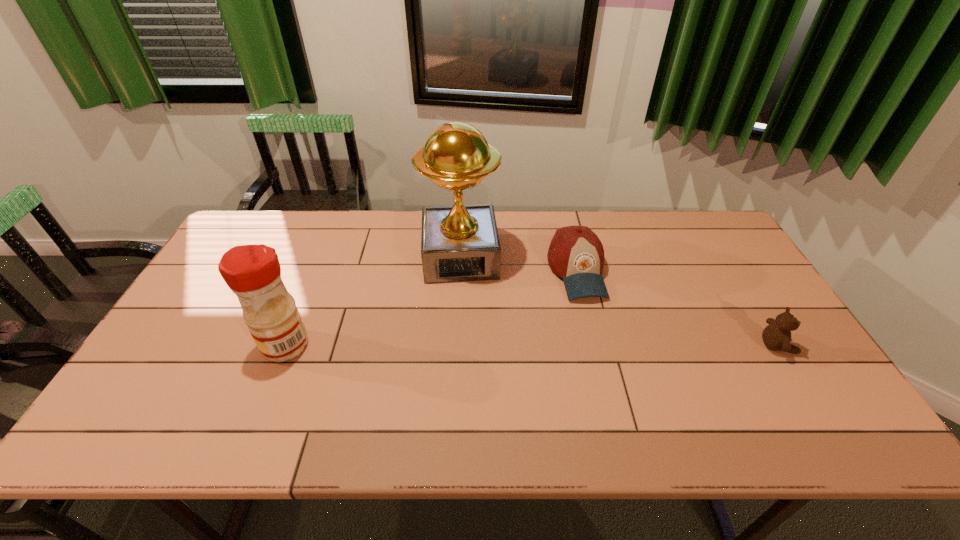
The image size is (960, 540). In order to click on free spot between the condiment and the rightmost object in this screenshot , I will do `click(532, 346)`.

Find the location of a particular element. object identified as the closest to the condiment is located at coordinates (459, 243).

Where is `object that ranks as the third closest to the second object from right to left`? object that ranks as the third closest to the second object from right to left is located at coordinates (252, 272).

In order to click on vacant region that satisfies the following two spatial constraints: 1. on the front side of the baseball cap; 2. at the face of the teddy bear in this screenshot , I will do `click(594, 346)`.

Where is `vacant space that satisfies the following two spatial constraints: 1. on the front side of the teddy bear; 2. at the face of the second object from left to right`? This screenshot has width=960, height=540. vacant space that satisfies the following two spatial constraints: 1. on the front side of the teddy bear; 2. at the face of the second object from left to right is located at coordinates (456, 346).

I want to click on vacant position in the image that satisfies the following two spatial constraints: 1. on the front side of the rightmost object; 2. at the face of the second object from right to left, so click(x=594, y=346).